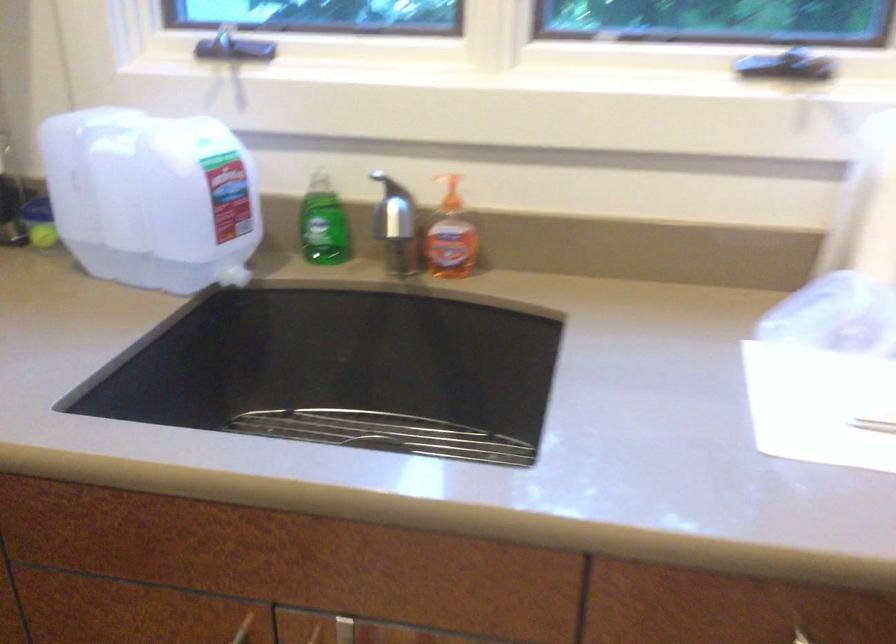
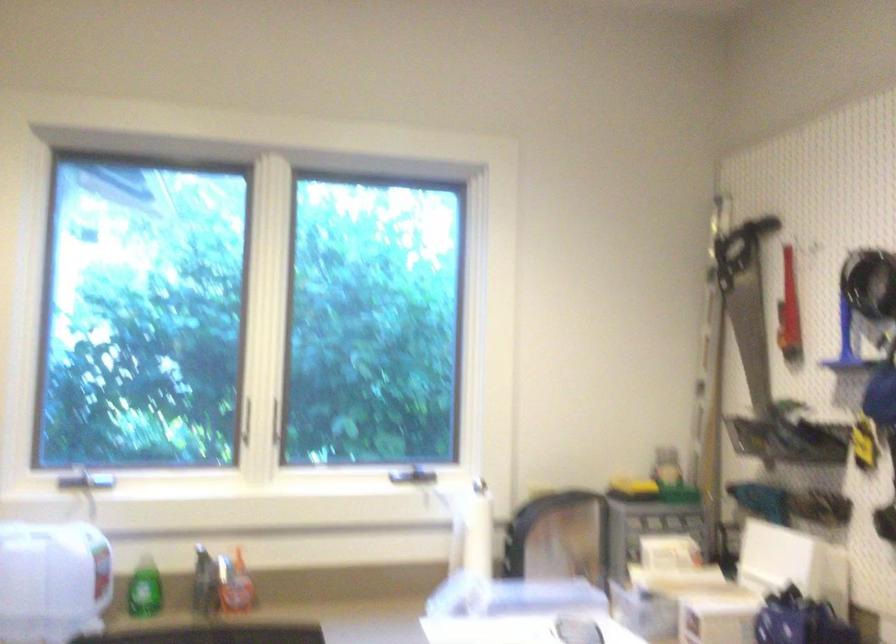
How did the camera likely rotate?

The camera's rotation is toward right-up.